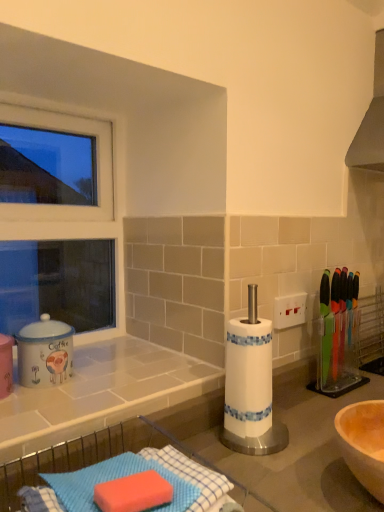
What is the approximate width of matte ceramic coffee canister at left?

The width of matte ceramic coffee canister at left is 4.23 inches.

What do you see at coordinates (74, 206) in the screenshot? I see `white plastic window frame at upper left` at bounding box center [74, 206].

I want to click on matte ceramic coffee canister at left, so click(45, 352).

From the image's perspective, which object appears higher, white plastic window frame at upper left or matte ceramic coffee canister at left?

From the image's view, white plastic window frame at upper left is above.

Does white plastic window frame at upper left have a lesser width compared to matte ceramic coffee canister at left?

Indeed, white plastic window frame at upper left has a lesser width compared to matte ceramic coffee canister at left.

Image resolution: width=384 pixels, height=512 pixels. What are the coordinates of `window frame that is on the left side of white tile countertop at lower left, the 1th countertop viewed from the top` in the screenshot? It's located at (74, 206).

In the scene shown: Considering the sizes of white plastic window frame at upper left and white tile countertop at lower left, the second countertop from the bottom, in the image, is white plastic window frame at upper left taller or shorter than white tile countertop at lower left, the second countertop from the bottom,?

In the image, white plastic window frame at upper left appears to be taller than white tile countertop at lower left, the second countertop from the bottom.

Considering the sizes of white plastic window frame at upper left and white tile countertop at lower left, the second countertop from the bottom, in the image, is white plastic window frame at upper left bigger or smaller than white tile countertop at lower left, the second countertop from the bottom,?

white plastic window frame at upper left is bigger than white tile countertop at lower left, the second countertop from the bottom.

Is white plastic window frame at upper left outside of white tile countertop at lower left, the second countertop from the bottom?

Yes, white plastic window frame at upper left is located beyond the bounds of white tile countertop at lower left, the second countertop from the bottom.

Are white plastic window frame at upper left and blue textured sponge at lower left, the 2th countertop from the top, beside each other?

white plastic window frame at upper left and blue textured sponge at lower left, the 2th countertop from the top, are clearly separated.

From the image's perspective, which one is positioned lower, white plastic window frame at upper left or blue textured sponge at lower left, placed as the first countertop when sorted from bottom to top?

blue textured sponge at lower left, placed as the first countertop when sorted from bottom to top, from the image's perspective.

Looking at this image, from a real-world perspective, is white plastic window frame at upper left positioned over blue textured sponge at lower left, placed as the first countertop when sorted from bottom to top, based on gravity?

Yes, from a real-world perspective, white plastic window frame at upper left is above blue textured sponge at lower left, placed as the first countertop when sorted from bottom to top.

Is the depth of white plastic window frame at upper left greater than that of blue textured sponge at lower left, placed as the first countertop when sorted from bottom to top?

Yes, it is behind blue textured sponge at lower left, placed as the first countertop when sorted from bottom to top.

Based on the photo, is matte ceramic coffee canister at left facing away from white plastic window frame at upper left?

Yes, matte ceramic coffee canister at left is positioned with its back facing white plastic window frame at upper left.

This screenshot has height=512, width=384. I want to click on appliance below the white plastic window frame at upper left (from a real-world perspective), so click(45, 352).

Is matte ceramic coffee canister at left with white plastic window frame at upper left?

No.

From a real-world perspective, is matte ceramic coffee canister at left physically above white plastic window frame at upper left?

No, from a real-world perspective, matte ceramic coffee canister at left is not above white plastic window frame at upper left.

From a real-world perspective, which is physically above, white tile countertop at lower left, the second countertop from the bottom, or blue textured sponge at lower left, the 2th countertop from the top?

From a 3D spatial view, white tile countertop at lower left, the second countertop from the bottom, is above.

I want to click on countertop that is behind the blue textured sponge at lower left, the 2th countertop from the top, so click(104, 394).

Does white tile countertop at lower left, the 1th countertop viewed from the top, have a lesser height compared to blue textured sponge at lower left, placed as the first countertop when sorted from bottom to top?

Correct, white tile countertop at lower left, the 1th countertop viewed from the top, is not as tall as blue textured sponge at lower left, placed as the first countertop when sorted from bottom to top.

From the image's perspective, is white tile countertop at lower left, the 1th countertop viewed from the top, above or below blue textured sponge at lower left, the 2th countertop from the top?

white tile countertop at lower left, the 1th countertop viewed from the top, is above blue textured sponge at lower left, the 2th countertop from the top.

Is white tile countertop at lower left, the second countertop from the bottom, in front of or behind matte ceramic coffee canister at left in the image?

white tile countertop at lower left, the second countertop from the bottom, is in front of matte ceramic coffee canister at left.

Which object is positioned more to the left, white tile countertop at lower left, the second countertop from the bottom, or matte ceramic coffee canister at left?

From the viewer's perspective, matte ceramic coffee canister at left appears more on the left side.

Are white tile countertop at lower left, the 1th countertop viewed from the top, and matte ceramic coffee canister at left beside each other?

No, white tile countertop at lower left, the 1th countertop viewed from the top, is not in contact with matte ceramic coffee canister at left.

Measure the distance between white tile countertop at lower left, the 1th countertop viewed from the top, and matte ceramic coffee canister at left.

They are 5.04 inches apart.

Can you tell me how much blue textured sponge at lower left, the 2th countertop from the top, and white tile countertop at lower left, the second countertop from the bottom, differ in facing direction?

0.138 degrees separate the facing orientations of blue textured sponge at lower left, the 2th countertop from the top, and white tile countertop at lower left, the second countertop from the bottom.

Is blue textured sponge at lower left, placed as the first countertop when sorted from bottom to top, taller than white tile countertop at lower left, the second countertop from the bottom?

Correct, blue textured sponge at lower left, placed as the first countertop when sorted from bottom to top, is much taller as white tile countertop at lower left, the second countertop from the bottom.

Would you say blue textured sponge at lower left, placed as the first countertop when sorted from bottom to top, is outside white tile countertop at lower left, the second countertop from the bottom?

blue textured sponge at lower left, placed as the first countertop when sorted from bottom to top, lies outside white tile countertop at lower left, the second countertop from the bottom,'s area.

Does blue textured sponge at lower left, placed as the first countertop when sorted from bottom to top, appear on the right side of white tile countertop at lower left, the second countertop from the bottom?

Yes, blue textured sponge at lower left, placed as the first countertop when sorted from bottom to top, is to the right of white tile countertop at lower left, the second countertop from the bottom.

This screenshot has height=512, width=384. What are the coordinates of `window frame above the matte ceramic coffee canister at left (from the image's perspective)` in the screenshot? It's located at (74, 206).

The width and height of the screenshot is (384, 512). Identify the location of window frame behind the white tile countertop at lower left, the second countertop from the bottom. (74, 206).

Which object lies nearer to the anchor point white tile countertop at lower left, the second countertop from the bottom, white plastic window frame at upper left or blue textured sponge at lower left, placed as the first countertop when sorted from bottom to top?

blue textured sponge at lower left, placed as the first countertop when sorted from bottom to top, is closer to white tile countertop at lower left, the second countertop from the bottom.

When comparing their distances from white tile countertop at lower left, the 1th countertop viewed from the top, does matte ceramic coffee canister at left or white plastic window frame at upper left seem further?

white plastic window frame at upper left is positioned further to the anchor white tile countertop at lower left, the 1th countertop viewed from the top.

From the image, which object appears to be nearer to blue textured sponge at lower left, the 2th countertop from the top, white tile countertop at lower left, the second countertop from the bottom, or white plastic window frame at upper left?

Among the two, white tile countertop at lower left, the second countertop from the bottom, is located nearer to blue textured sponge at lower left, the 2th countertop from the top.

From the image, which object appears to be farther from white plastic window frame at upper left, white tile countertop at lower left, the 1th countertop viewed from the top, or blue textured sponge at lower left, the 2th countertop from the top?

blue textured sponge at lower left, the 2th countertop from the top.

Considering their positions, is white tile countertop at lower left, the second countertop from the bottom, positioned closer to blue textured sponge at lower left, placed as the first countertop when sorted from bottom to top, than matte ceramic coffee canister at left?

white tile countertop at lower left, the second countertop from the bottom.

From the image, which object appears to be farther from white plastic window frame at upper left, blue textured sponge at lower left, placed as the first countertop when sorted from bottom to top, or matte ceramic coffee canister at left?

blue textured sponge at lower left, placed as the first countertop when sorted from bottom to top, is positioned further to the anchor white plastic window frame at upper left.

From the image, which object appears to be nearer to matte ceramic coffee canister at left, white tile countertop at lower left, the 1th countertop viewed from the top, or blue textured sponge at lower left, the 2th countertop from the top?

Among the two, white tile countertop at lower left, the 1th countertop viewed from the top, is located nearer to matte ceramic coffee canister at left.

Considering their positions, is white plastic window frame at upper left positioned further to matte ceramic coffee canister at left than white tile countertop at lower left, the 1th countertop viewed from the top?

Among the two, white plastic window frame at upper left is located further to matte ceramic coffee canister at left.

Locate an element on the screen. countertop between blue textured sponge at lower left, the 2th countertop from the top, and matte ceramic coffee canister at left from front to back is located at coordinates (104, 394).

You are a GUI agent. You are given a task and a screenshot of the screen. Output one action in this format:
    pyautogui.click(x=<x>, y=<y>)
    Task: Click on the countertop located between blue textured sponge at lower left, the 2th countertop from the top, and white plastic window frame at upper left in the depth direction
    The width and height of the screenshot is (384, 512).
    Given the screenshot: What is the action you would take?
    pyautogui.click(x=104, y=394)

Image resolution: width=384 pixels, height=512 pixels. What are the coordinates of `appliance between white plastic window frame at upper left and white tile countertop at lower left, the 1th countertop viewed from the top, in the vertical direction` in the screenshot? It's located at (45, 352).

Identify the location of appliance positioned between blue textured sponge at lower left, the 2th countertop from the top, and white plastic window frame at upper left from near to far. This screenshot has height=512, width=384. coord(45,352).